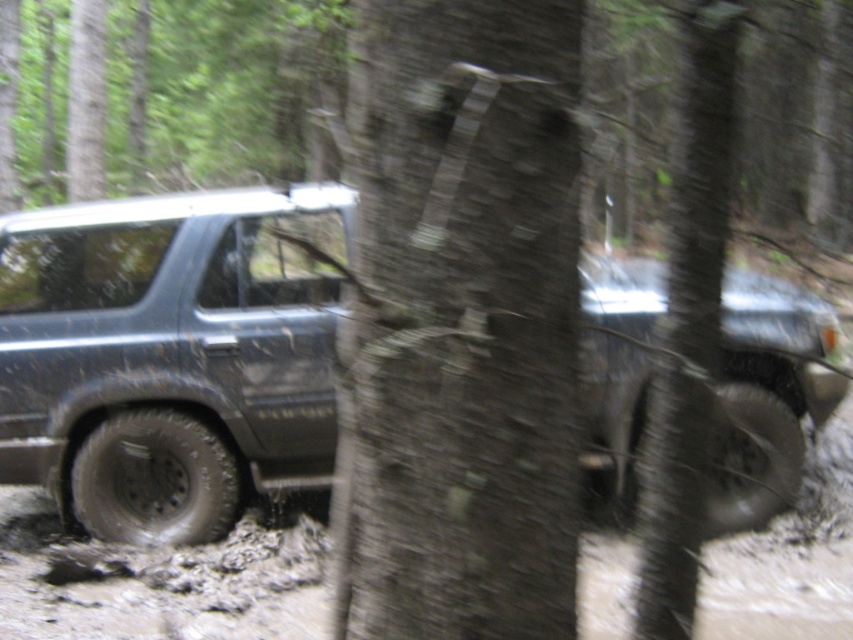
Question: Among these objects, which one is farthest from the camera?

Choices:
 (A) muddy rubber tire at lower left
 (B) brown rough bark at center
 (C) muddy rubber tire at lower right
 (D) smooth bark tree trunk at center

Answer: (A)

Question: Can you confirm if muddy rubber jeep at center is positioned to the right of smooth bark tree trunk at center?

Choices:
 (A) no
 (B) yes

Answer: (A)

Question: Which point is farther from the camera taking this photo?

Choices:
 (A) (776, 369)
 (B) (723, 433)
 (C) (682, 522)

Answer: (A)

Question: Which of the following is the closest to the observer?

Choices:
 (A) smooth bark tree trunk at center
 (B) brown rough bark at center
 (C) muddy rubber tire at lower left
 (D) muddy rubber jeep at center

Answer: (B)

Question: Is muddy rubber jeep at center positioned in front of muddy rubber tire at lower left?

Choices:
 (A) no
 (B) yes

Answer: (B)

Question: Is brown rough bark at center bigger than muddy rubber tire at lower right?

Choices:
 (A) yes
 (B) no

Answer: (A)